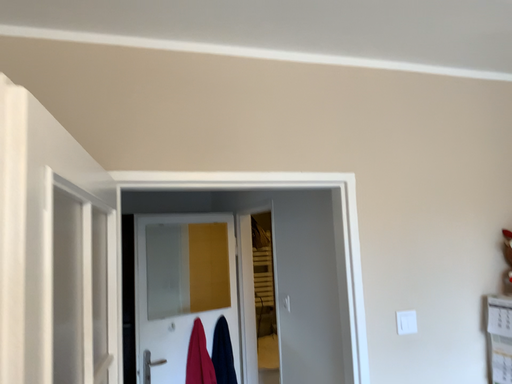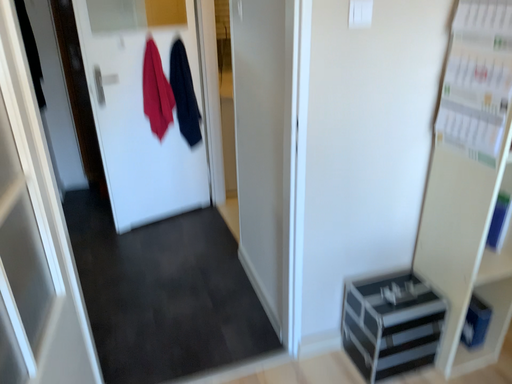
Question: How did the camera likely rotate when shooting the video?

Choices:
 (A) rotated downward
 (B) rotated upward

Answer: (A)